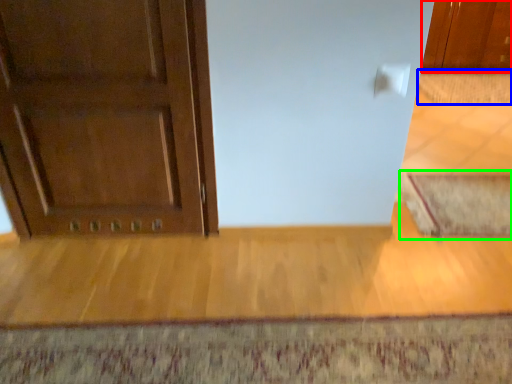
Question: Which object is positioned farthest from cabinetry (highlighted by a red box)? Select from doormat (highlighted by a blue box) and doormat (highlighted by a green box).

Choices:
 (A) doormat
 (B) doormat

Answer: (B)